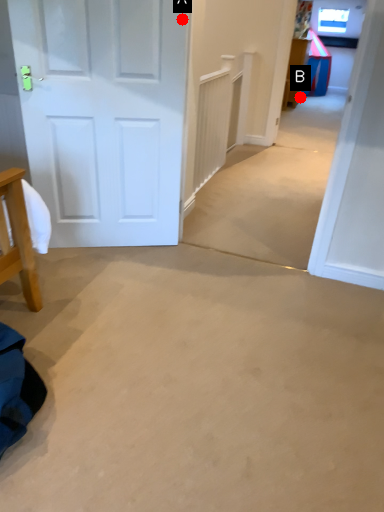
Question: Two points are circled on the image, labeled by A and B beside each circle. Which point is closer to the camera?

Choices:
 (A) A is closer
 (B) B is closer

Answer: (A)